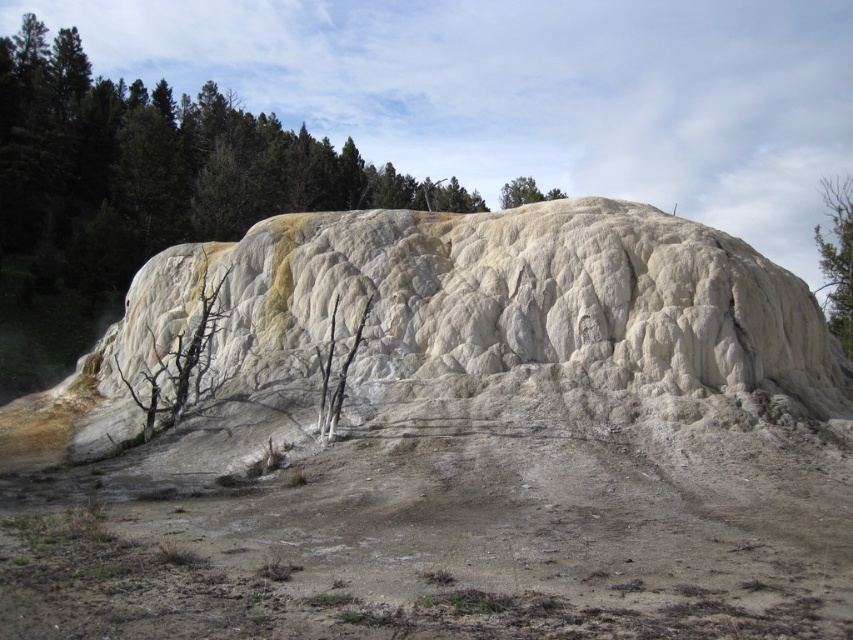
Question: Is dull brown dirt track at lower center further to the viewer compared to white textured rock at center?

Choices:
 (A) yes
 (B) no

Answer: (B)

Question: Can you confirm if dull brown dirt track at lower center is positioned to the left of green leafy tree at upper right?

Choices:
 (A) yes
 (B) no

Answer: (A)

Question: Is white textured rock at center positioned before green leafy tree at upper right?

Choices:
 (A) yes
 (B) no

Answer: (A)

Question: Estimate the real-world distances between objects in this image. Which object is closer to the dull brown dirt track at lower center?

Choices:
 (A) white textured rock at center
 (B) green leafy tree at upper right

Answer: (A)

Question: Which of the following is the farthest from the observer?

Choices:
 (A) (838, 259)
 (B) (316, 484)

Answer: (A)

Question: Considering the real-world distances, which object is farthest from the dull brown dirt track at lower center?

Choices:
 (A) white textured rock at center
 (B) green leafy tree at upper right

Answer: (B)